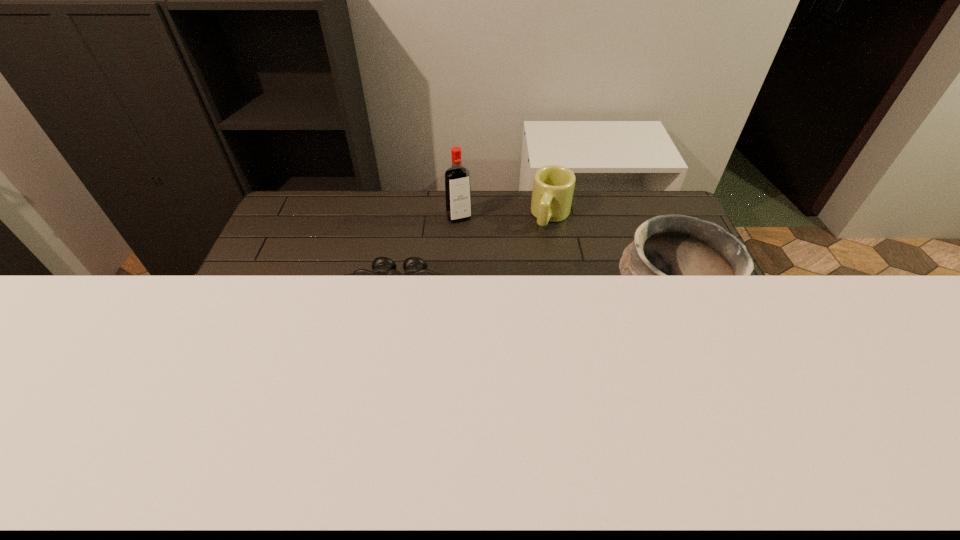
Find the location of `vacant point located between the binoculars and the rightmost object`. vacant point located between the binoculars and the rightmost object is located at coordinates (531, 308).

Locate which object ranks third in proximity to the rightmost object. Please provide its 2D coordinates. Your answer should be formatted as a tuple, i.e. [(x, y)], where the tuple contains the x and y coordinates of a point satisfying the conditions above.

[(457, 178)]

Where is `object that can be found as the closest to the pottery`? Image resolution: width=960 pixels, height=540 pixels. object that can be found as the closest to the pottery is located at coordinates (553, 186).

Locate an element on the screen. This screenshot has width=960, height=540. free spot that satisfies the following two spatial constraints: 1. at the eyepieces of the third shortest object; 2. on the left side of the binoculars is located at coordinates click(x=397, y=308).

You are a GUI agent. You are given a task and a screenshot of the screen. Output one action in this format:
    pyautogui.click(x=<x>, y=<y>)
    Task: Click on the free space that satisfies the following two spatial constraints: 1. on the front side of the vodka; 2. on the left side of the third shortest object
    Image resolution: width=960 pixels, height=540 pixels.
    Given the screenshot: What is the action you would take?
    pyautogui.click(x=454, y=308)

Where is `free space that satisfies the following two spatial constraints: 1. at the eyepieces of the binoculars; 2. on the right side of the second tallest object`? free space that satisfies the following two spatial constraints: 1. at the eyepieces of the binoculars; 2. on the right side of the second tallest object is located at coordinates (397, 308).